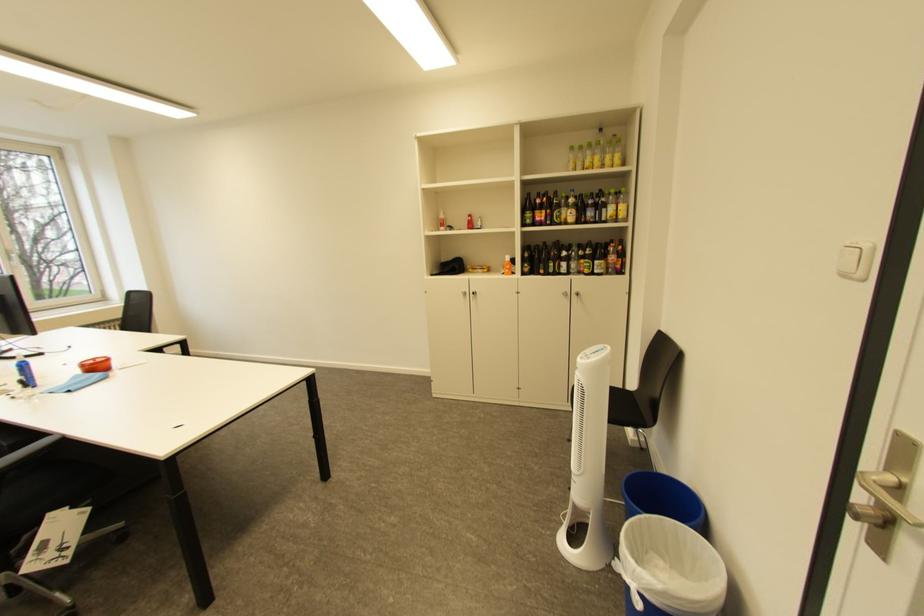
Where would you pull the silver door handle? Please return your answer as a coordinate pair (x, y).

(888, 493)